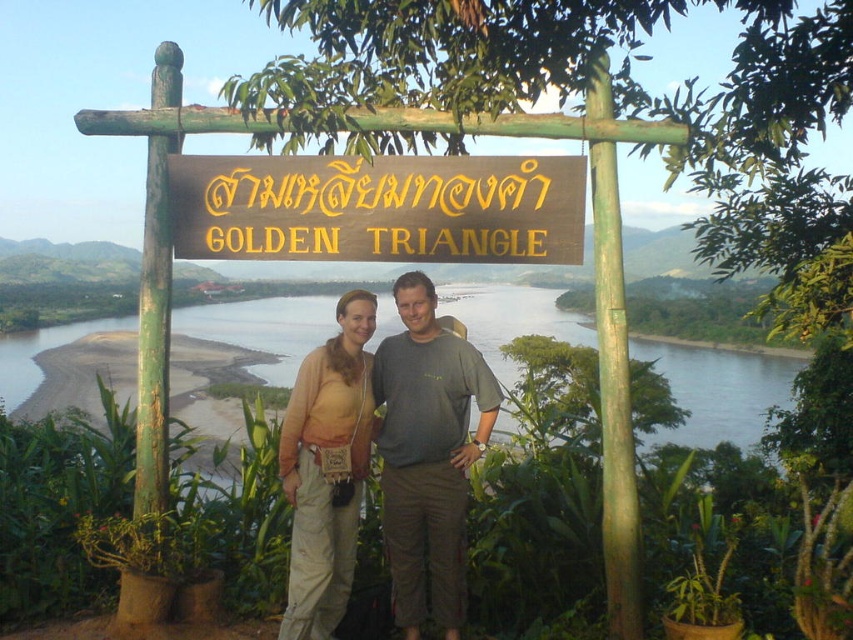
Question: Which point is closer to the camera?

Choices:
 (A) (27, 352)
 (B) (397, 420)
 (C) (282, 198)
 (D) (289, 456)

Answer: (D)

Question: Does gold/yellow wood sign at center appear under green water at center?

Choices:
 (A) yes
 (B) no

Answer: (B)

Question: Observing the image, what is the correct spatial positioning of green water at center in reference to beige cotton pants at center?

Choices:
 (A) below
 (B) above

Answer: (B)

Question: Which of the following is the farthest from the observer?

Choices:
 (A) gray cotton t-shirt at center
 (B) beige cotton pants at center
 (C) gold/yellow wood sign at center
 (D) green water at center

Answer: (D)

Question: Which point is closer to the camera?

Choices:
 (A) coord(399,260)
 (B) coord(312,422)

Answer: (B)

Question: Can you confirm if gold/yellow wood sign at center is positioned to the right of beige cotton pants at center?

Choices:
 (A) yes
 (B) no

Answer: (A)